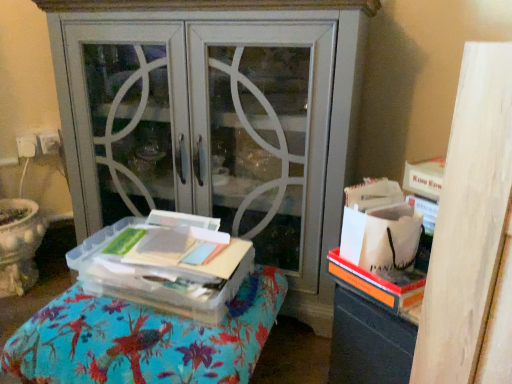
This screenshot has height=384, width=512. Identify the location of matte gray cabinet at center. (209, 125).

What do you see at coordinates (164, 264) in the screenshot?
I see `clear plastic container at center` at bounding box center [164, 264].

Locate an element on the screen. The width and height of the screenshot is (512, 384). clear plastic container at center is located at coordinates (143, 339).

I want to click on matte gray cabinet at center, so click(x=209, y=125).

From the image's perspective, which is above, matte gray cabinet at center or clear plastic container at center?

matte gray cabinet at center appears higher in the image.

Considering the sizes of objects matte gray cabinet at center and clear plastic container at center in the image provided, who is wider, matte gray cabinet at center or clear plastic container at center?

With larger width is clear plastic container at center.

Can you confirm if matte gray cabinet at center is taller than clear plastic container at center?

Yes, matte gray cabinet at center is taller than clear plastic container at center.

Find the location of a particular element. Image resolution: width=512 pixels, height=384 pixels. furniture below the matte gray cabinet at center (from a real-world perspective) is located at coordinates (143, 339).

Which is closer, (47,330) or (99,274)?

The point (47,330) is closer to the camera.

Does clear plastic container at center have a lesser height compared to clear plastic container at center?

In fact, clear plastic container at center may be taller than clear plastic container at center.

Is clear plastic container at center touching clear plastic container at center?

clear plastic container at center and clear plastic container at center are clearly separated.

Is clear plastic container at center to the left of clear plastic container at center from the viewer's perspective?

Indeed, clear plastic container at center is positioned on the left side of clear plastic container at center.

Is clear plastic container at center with matte gray cabinet at center?

clear plastic container at center and matte gray cabinet at center are not in contact.

From the picture: From a real-world perspective, is clear plastic container at center under matte gray cabinet at center?

Yes.

Is clear plastic container at center wider than matte gray cabinet at center?

Correct, the width of clear plastic container at center exceeds that of matte gray cabinet at center.

Image resolution: width=512 pixels, height=384 pixels. I want to click on furniture on the left of clear plastic container at center, so click(143, 339).

In the image, is clear plastic container at center on the left side or the right side of clear plastic container at center?

clear plastic container at center is positioned on clear plastic container at center's right side.

Are clear plastic container at center and clear plastic container at center far apart?

No, clear plastic container at center is not far from clear plastic container at center.

Which object is wider, matte gray cabinet at center or clear plastic container at center?

Wider between the two is matte gray cabinet at center.

How much distance is there between matte gray cabinet at center and clear plastic container at center?

The distance of matte gray cabinet at center from clear plastic container at center is 28.92 centimeters.

The height and width of the screenshot is (384, 512). In order to click on cardboard box below the matte gray cabinet at center (from a real-world perspective) in this screenshot , I will do `click(164, 264)`.

Is matte gray cabinet at center looking in the opposite direction of clear plastic container at center?

No, matte gray cabinet at center is not facing the opposite direction of clear plastic container at center.

Does clear plastic container at center have a greater width compared to matte gray cabinet at center?

In fact, clear plastic container at center might be narrower than matte gray cabinet at center.

Where is `screen door located above the clear plastic container at center (from the image's perspective)`? screen door located above the clear plastic container at center (from the image's perspective) is located at coordinates (209, 125).

Based on the photo, does clear plastic container at center come behind matte gray cabinet at center?

No, clear plastic container at center is closer to the viewer.

Is clear plastic container at center facing away from matte gray cabinet at center?

Yes, clear plastic container at center is positioned with its back facing matte gray cabinet at center.

Find the location of a particular element. Image resolution: width=512 pixels, height=384 pixels. furniture below the matte gray cabinet at center (from the image's perspective) is located at coordinates (143, 339).

Image resolution: width=512 pixels, height=384 pixels. Identify the location of cardboard box that appears behind the clear plastic container at center. (164, 264).

From the picture: When comparing their distances from clear plastic container at center, does matte gray cabinet at center or clear plastic container at center seem closer?

Among the two, clear plastic container at center is located nearer to clear plastic container at center.

Which object lies nearer to the anchor point clear plastic container at center, matte gray cabinet at center or clear plastic container at center?

clear plastic container at center lies closer to clear plastic container at center than the other object.

Based on their spatial positions, is clear plastic container at center or clear plastic container at center closer to matte gray cabinet at center?

Based on the image, clear plastic container at center appears to be nearer to matte gray cabinet at center.

Looking at this image, when comparing their distances from matte gray cabinet at center, does clear plastic container at center or clear plastic container at center seem closer?

clear plastic container at center lies closer to matte gray cabinet at center than the other object.

Looking at the image, which one is located further to clear plastic container at center, clear plastic container at center or matte gray cabinet at center?

matte gray cabinet at center is further to clear plastic container at center.

Considering their positions, is clear plastic container at center positioned closer to clear plastic container at center than matte gray cabinet at center?

clear plastic container at center.

Locate an element on the screen. cardboard box between matte gray cabinet at center and clear plastic container at center vertically is located at coordinates (164, 264).